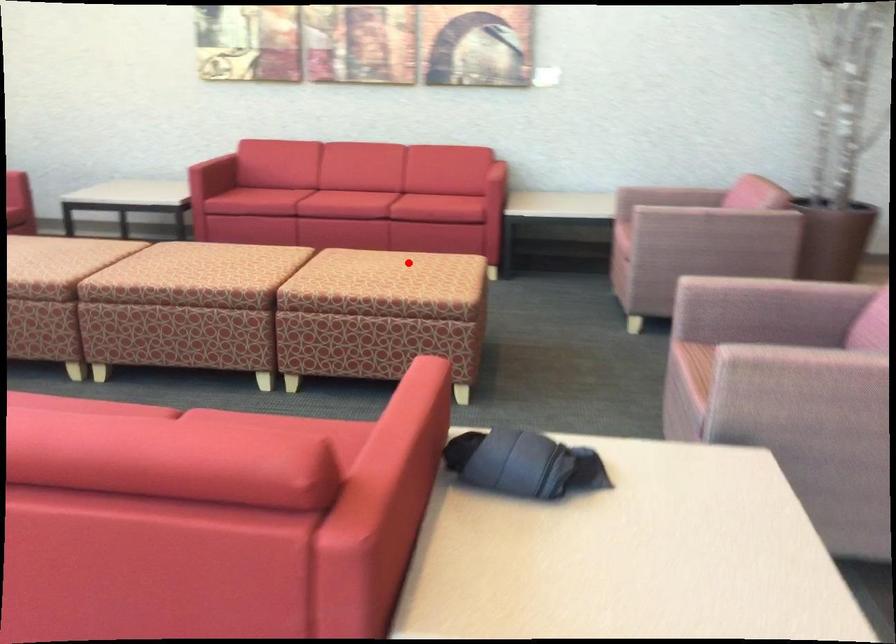
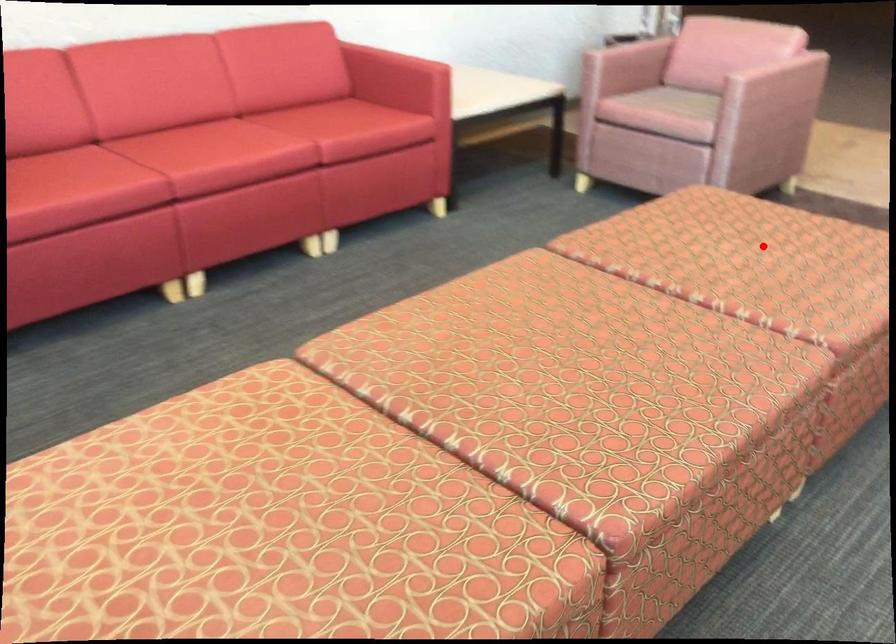
I am providing you with two images of the same scene from different viewpoints. A red point is marked on the first image and another point is marked on the second image. Do the highlighted points in image1 and image2 indicate the same real-world spot?

Yes